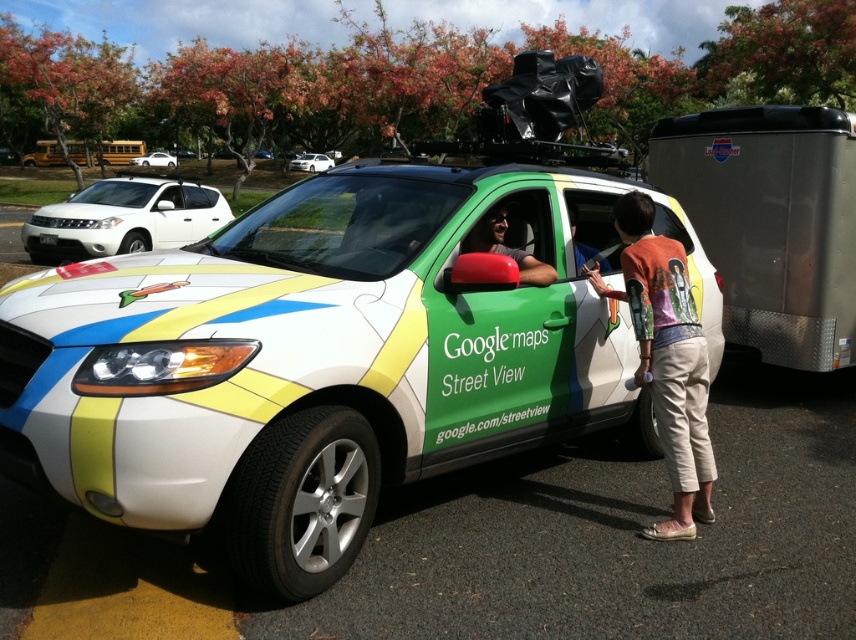
You are a delivery person who needs to load a package onto the roof of the white glossy google maps street view car at center. The package is 28 inches wide. Can you safely place it on the roof without touching the matte green car door at center?

The white glossy google maps street view car at center is 30.06 inches from the matte green car door at center. Since the package is 28 inches wide, it can be safely placed on the roof without touching the door as there is enough space between them.

You are a delivery drone operator. Your drone is currently at coordinates 0.559, 0.382. You need to deliver a package to the white glossy google maps street view car at center. What is the shortest path you can take to reach the car?

The white glossy google maps street view car at center is already at your current coordinates (325,356), so you are already at the car and can deliver the package immediately.